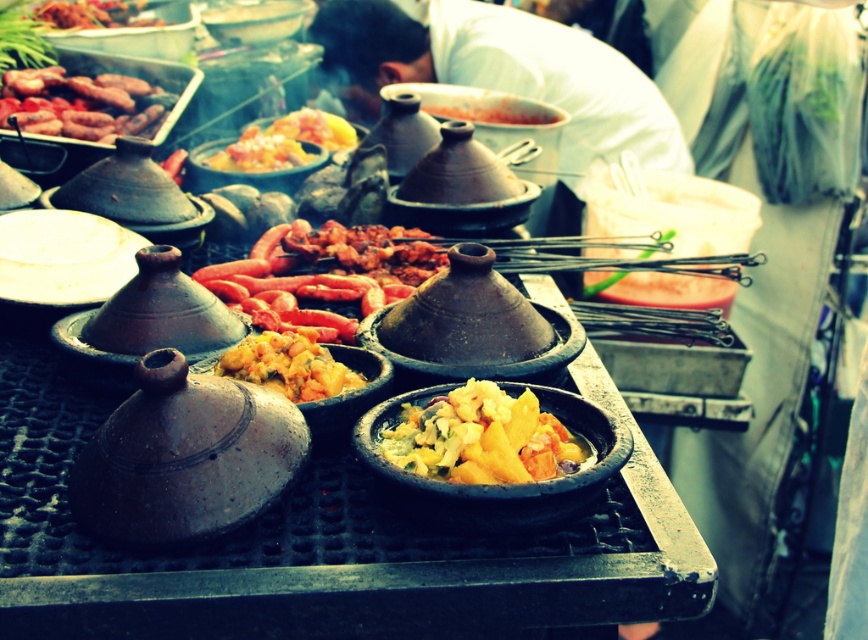
You are a customer at the food stall and want to order both the yellowish matte clay bowl at center and the brown glossy sausages at left. Which item is positioned closer to the right side of the stall?

The yellowish matte clay bowl at center is positioned to the right of the brown glossy sausages at left, so the yellowish matte clay bowl at center is closer to the right side of the stall.

You are a food vendor who wants to hang a decorative banner 2.5 meters away from the viewer. Is the white fabric at upper center positioned at the correct distance for this purpose?

The white fabric at upper center is 3.04 meters from viewer, which is slightly farther than the desired 2.5 meters, so it is not positioned at the correct distance.

You are a customer at the food stall and you want to know if the white fabric at upper center is taller than the grilled sausages at center. Can you confirm this?

The white fabric at upper center is taller than grilled sausages at center according to the description.